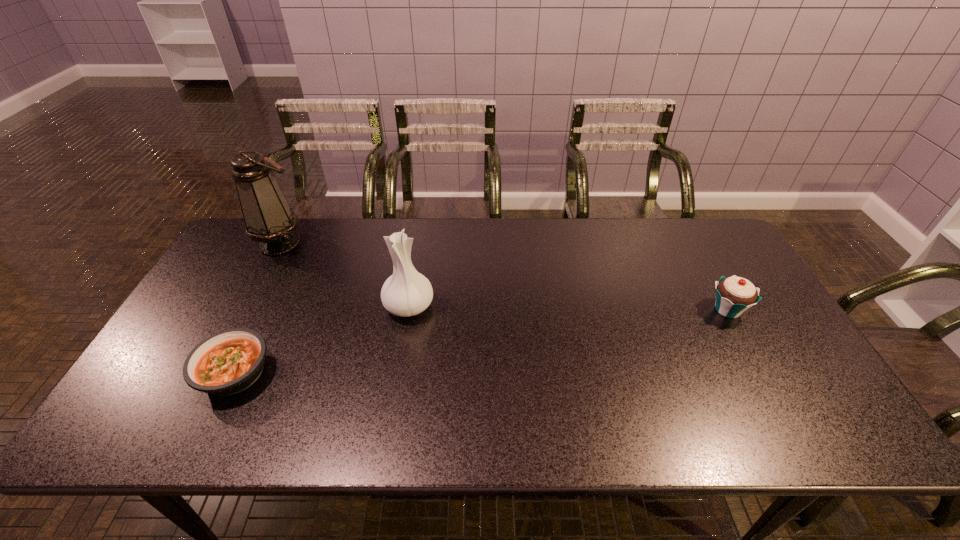
At what (x,y) coordinates should I click in order to perform the action: click on vacant area located on the front of the cupcake. Please return your answer as a coordinate pair (x, y). This screenshot has height=540, width=960. Looking at the image, I should click on (756, 361).

Locate an element on the screen. The width and height of the screenshot is (960, 540). vacant point located on the back of the nearest object is located at coordinates (261, 318).

Locate an element on the screen. The height and width of the screenshot is (540, 960). object at the far edge is located at coordinates (269, 220).

This screenshot has height=540, width=960. Find the location of `oil lamp that is at the left edge`. oil lamp that is at the left edge is located at coordinates (269, 220).

The image size is (960, 540). Identify the location of stew located in the left edge section of the desktop. (228, 362).

Identify the location of object at the right edge. (734, 295).

You are a GUI agent. You are given a task and a screenshot of the screen. Output one action in this format:
    pyautogui.click(x=<x>, y=<y>)
    Task: Click on the object that is at the far left corner
    
    Given the screenshot: What is the action you would take?
    pyautogui.click(x=269, y=220)

What are the coordinates of `free space at the far edge of the desktop` in the screenshot? It's located at (573, 235).

The width and height of the screenshot is (960, 540). In the image, there is a desktop. What are the coordinates of `vacant space at the near edge` in the screenshot? It's located at (279, 420).

The height and width of the screenshot is (540, 960). I want to click on vacant area at the left edge of the desktop, so click(x=264, y=275).